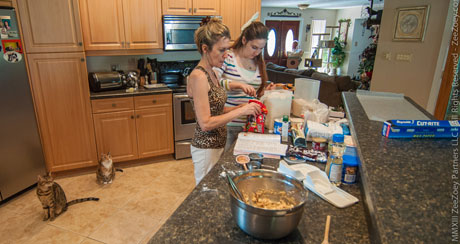
Where is `oven`? Image resolution: width=460 pixels, height=244 pixels. oven is located at coordinates (182, 104).